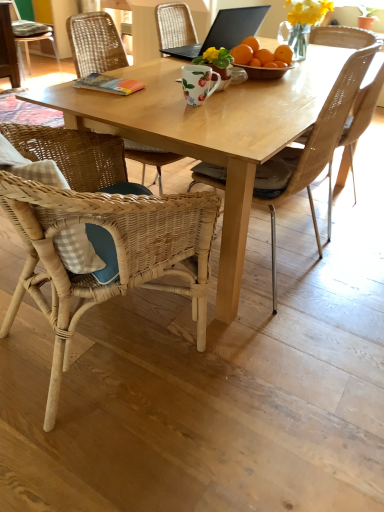
What is the approximate width of woven wicker chair at lower left, arranged as the third chair when viewed from the right?

It is 26.28 inches.

The width and height of the screenshot is (384, 512). Describe the element at coordinates (198, 83) in the screenshot. I see `floral matte coffee cup at center` at that location.

The width and height of the screenshot is (384, 512). What do you see at coordinates (224, 31) in the screenshot?
I see `black matte laptop at upper center` at bounding box center [224, 31].

This screenshot has height=512, width=384. What are the coordinates of `woven wicker chair at right, marked as the 4th chair in a left-to-right arrangement` in the screenshot? It's located at (344, 37).

From a real-world perspective, is woven wood chair at center, which appears as the 3th chair when viewed from the back, physically above black matte laptop at upper center?

No, from a real-world perspective, woven wood chair at center, which appears as the 3th chair when viewed from the back, is not above black matte laptop at upper center.

From the picture: Is woven wood chair at center, the 2th chair in the front-to-back sequence, positioned with its back to black matte laptop at upper center?

No.

Is point (269, 204) farther from viewer compared to point (343, 42)?

No, it is not.

Who is shorter, woven wood chair at center, the 2th chair in the front-to-back sequence, or woven wicker chair at right, which is the 3th chair from front to back?

With less height is woven wicker chair at right, which is the 3th chair from front to back.

Which object is closer to the camera, woven wood chair at center, which appears as the 3th chair when viewed from the back, or woven wicker chair at right, which is the 3th chair from front to back?

woven wood chair at center, which appears as the 3th chair when viewed from the back, is closer to the camera.

Which chair is the 2nd one when counting from the right side of the black matte laptop at upper center? Please provide its 2D coordinates.

[(344, 37)]

Does black matte laptop at upper center have a greater height compared to woven wicker chair at right, the second chair viewed from the back?

Incorrect, the height of black matte laptop at upper center is not larger of that of woven wicker chair at right, the second chair viewed from the back.

From the picture: Is black matte laptop at upper center facing away from woven wicker chair at right, the second chair viewed from the back?

Absolutely, black matte laptop at upper center is directed away from woven wicker chair at right, the second chair viewed from the back.

Which object is positioned more to the right, black matte laptop at upper center or woven wicker chair at right, which is the 3th chair from front to back?

Positioned to the right is woven wicker chair at right, which is the 3th chair from front to back.

Is black matte laptop at upper center at the back of woven wood chair at upper left, which is the 1th chair from back to front?

That's not correct — woven wood chair at upper left, which is the 1th chair from back to front, is not looking away from black matte laptop at upper center.

Considering the positions of points (37, 40) and (223, 26), is point (37, 40) closer to camera compared to point (223, 26)?

No, it is not.

From the image's perspective, is woven wood chair at upper left, the fourth chair positioned from the right, located above or below black matte laptop at upper center?

Clearly, from the image's perspective, woven wood chair at upper left, the fourth chair positioned from the right, is above black matte laptop at upper center.

Identify the location of chair behind the black matte laptop at upper center. (31, 38).

From the woven wood chair at upper left, which is the fourth chair from front to back, count 1st chair to the right and point to it. Please provide its 2D coordinates.

[(100, 234)]

Can you tell me how much woven wicker chair at lower left, arranged as the third chair when viewed from the right, and woven wood chair at upper left, which is the 1th chair from back to front, differ in facing direction?

The facing directions of woven wicker chair at lower left, arranged as the third chair when viewed from the right, and woven wood chair at upper left, which is the 1th chair from back to front, are 75.3 degrees apart.

From a real-world perspective, is woven wicker chair at lower left, which ranks as the 1th chair in front-to-back order, over woven wood chair at upper left, the fourth chair positioned from the right?

No, from a real-world perspective, woven wicker chair at lower left, which ranks as the 1th chair in front-to-back order, is not above woven wood chair at upper left, the fourth chair positioned from the right.

Which is closer to the camera, (60, 368) or (42, 24)?

The point (60, 368) is in front.

Which object is positioned more to the left, woven wood chair at upper left, placed as the first chair when sorted from left to right, or woven wicker chair at right, which is the 3th chair from front to back?

woven wood chair at upper left, placed as the first chair when sorted from left to right.

Which point is more forward, (20, 49) or (327, 42)?

The point (327, 42) is closer to the camera.

At what (x,y) coordinates should I click in order to perform the action: click on chair behind the woven wicker chair at right, which is the 3th chair from front to back. Please return your answer as a coordinate pair (x, y). The width and height of the screenshot is (384, 512). Looking at the image, I should click on (31, 38).

From a real-world perspective, which is physically below, woven wood chair at upper left, placed as the first chair when sorted from left to right, or woven wicker chair at right, which ranks as the 1th chair in right-to-left order?

From a 3D spatial view, woven wood chair at upper left, placed as the first chair when sorted from left to right, is below.

Can we say woven wicker chair at right, the second chair viewed from the back, lies outside woven wicker chair at lower left, the 2th chair when ordered from left to right?

Yes, woven wicker chair at right, the second chair viewed from the back, is located beyond the bounds of woven wicker chair at lower left, the 2th chair when ordered from left to right.

Is woven wicker chair at right, which ranks as the 1th chair in right-to-left order, turned away from woven wicker chair at lower left, which ranks as the 1th chair in front-to-back order?

That's not correct — woven wicker chair at right, which ranks as the 1th chair in right-to-left order, is not looking away from woven wicker chair at lower left, which ranks as the 1th chair in front-to-back order.

Can you confirm if woven wicker chair at right, the second chair viewed from the back, is smaller than woven wicker chair at lower left, arranged as the third chair when viewed from the right?

Yes.

Between woven wicker chair at right, which is the 3th chair from front to back, and woven wicker chair at lower left, the 2th chair when ordered from left to right, which one is positioned in front?

woven wicker chair at lower left, the 2th chair when ordered from left to right, is in front.

From the black matte laptop at upper center, count 2nd chairs forward and point to it. Please provide its 2D coordinates.

[(312, 152)]

At what (x,y) coordinates should I click in order to perform the action: click on chair that appears on the right of woven wood chair at center, the 2th chair in the front-to-back sequence. Please return your answer as a coordinate pair (x, y). Looking at the image, I should click on (344, 37).

When comparing their distances from floral matte coffee cup at center, does green leafy plant at upper right or woven wood chair at upper left, the fourth chair positioned from the right, seem further?

woven wood chair at upper left, the fourth chair positioned from the right, is further to floral matte coffee cup at center.

Which object lies nearer to the anchor point black matte laptop at upper center, woven wood chair at center, placed as the 3th chair when sorted from left to right, or woven wicker chair at right, marked as the 4th chair in a left-to-right arrangement?

Among the two, woven wicker chair at right, marked as the 4th chair in a left-to-right arrangement, is located nearer to black matte laptop at upper center.

From the image, which object appears to be nearer to woven wood chair at center, acting as the 2th chair starting from the right, woven wicker chair at lower left, the 2th chair when ordered from left to right, or woven wood chair at upper left, which is the 1th chair from back to front?

Among the two, woven wicker chair at lower left, the 2th chair when ordered from left to right, is located nearer to woven wood chair at center, acting as the 2th chair starting from the right.

Estimate the real-world distances between objects in this image. Which object is closer to black matte laptop at upper center, floral matte coffee cup at center or woven wood chair at center, placed as the 3th chair when sorted from left to right?

floral matte coffee cup at center lies closer to black matte laptop at upper center than the other object.

Which object lies nearer to the anchor point woven wicker chair at lower left, the 4th chair when ordered from back to front, woven wood chair at upper left, which is the fourth chair from front to back, or woven wood chair at center, placed as the 3th chair when sorted from left to right?

Based on the image, woven wood chair at center, placed as the 3th chair when sorted from left to right, appears to be nearer to woven wicker chair at lower left, the 4th chair when ordered from back to front.

Looking at the image, which one is located closer to woven wood chair at upper left, which is the fourth chair from front to back, floral matte coffee cup at center or black matte laptop at upper center?

black matte laptop at upper center.

Estimate the real-world distances between objects in this image. Which object is further from woven wood chair at center, which appears as the 3th chair when viewed from the back, woven wicker chair at right, marked as the 4th chair in a left-to-right arrangement, or black matte laptop at upper center?

black matte laptop at upper center is further to woven wood chair at center, which appears as the 3th chair when viewed from the back.

Which object lies further to the anchor point woven wood chair at center, placed as the 3th chair when sorted from left to right, black matte laptop at upper center or green leafy plant at upper right?

Based on the image, green leafy plant at upper right appears to be further to woven wood chair at center, placed as the 3th chair when sorted from left to right.

Locate an element on the screen. The image size is (384, 512). coffee cup between black matte laptop at upper center and woven wicker chair at lower left, the 2th chair when ordered from left to right, vertically is located at coordinates (x=198, y=83).

Identify the location of coffee cup between woven wicker chair at lower left, the 4th chair when ordered from back to front, and woven wicker chair at right, marked as the 4th chair in a left-to-right arrangement, from left to right. (198, 83).

I want to click on laptop between woven wicker chair at right, which ranks as the 1th chair in right-to-left order, and green leafy plant at upper right from front to back, so click(x=224, y=31).

What are the coordinates of `chair between floral matte coffee cup at center and woven wood chair at upper left, placed as the first chair when sorted from left to right, from front to back` in the screenshot? It's located at (344, 37).